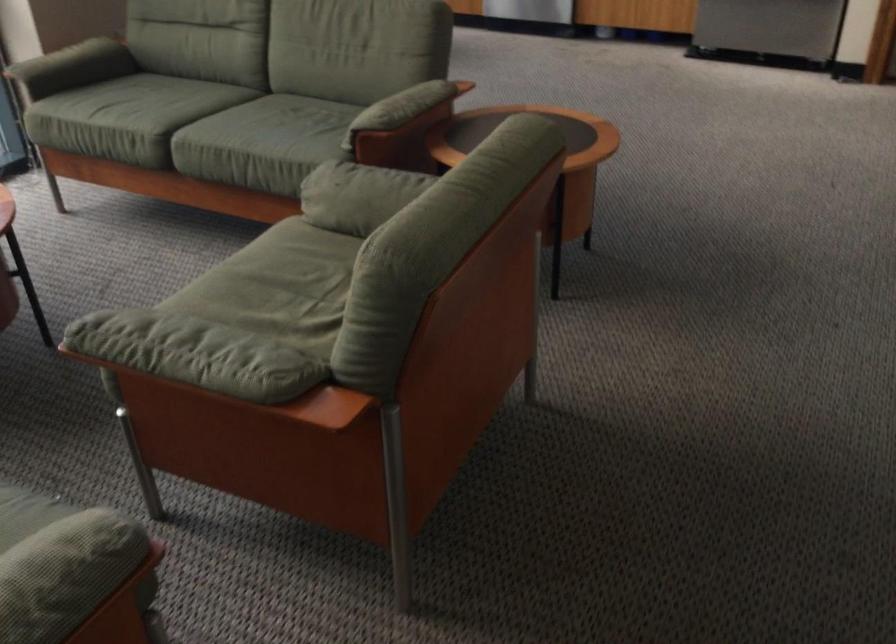
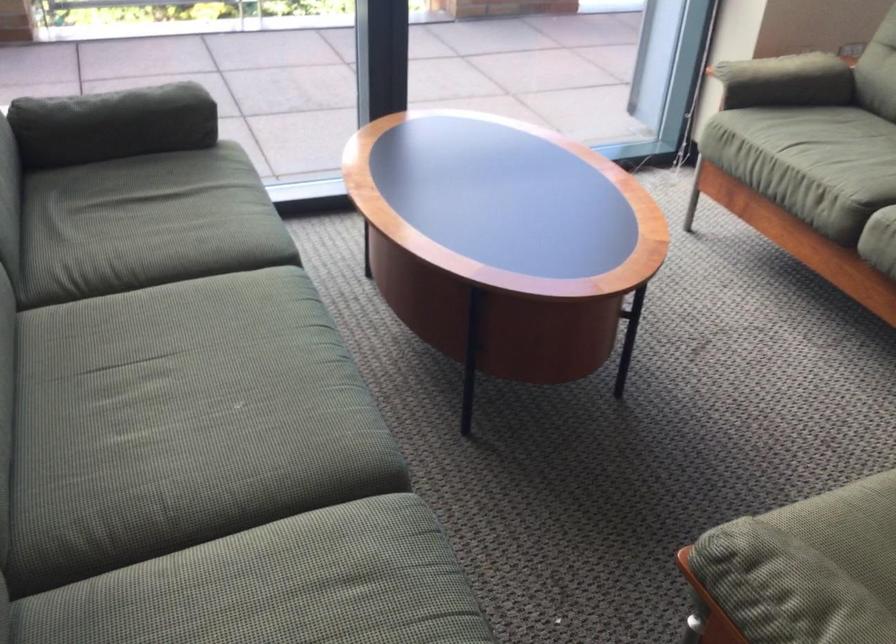
In the second image, find the point that corresponds to [149,122] in the first image.

(846, 180)